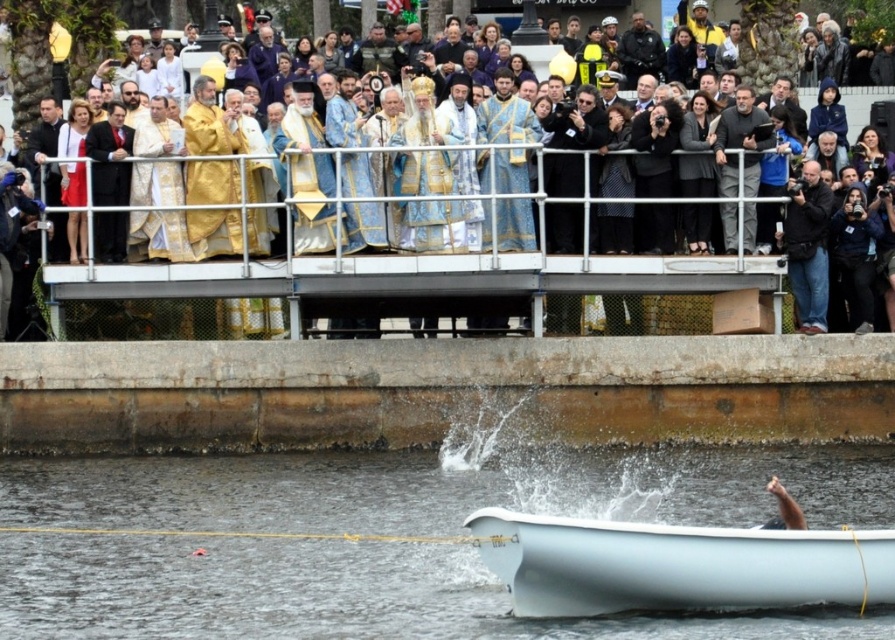
You are a photographer trying to capture the white matte boat at lower center and the smooth white hand at lower right in the same frame. Based on their positions, which object would appear closer to the camera in the photo?

The smooth white hand at lower right appears closer to the camera because it is positioned above the white matte boat at lower center, which is located below it.

You are standing on the raised platform above the water and want to throw a small object to someone in the white matte boat at lower center. The object can travel 200 feet. Do you think it will reach them?

The distance between the raised platform and the white matte boat at lower center is 194.24 feet, so yes, the object can reach them since it can travel 200 feet.